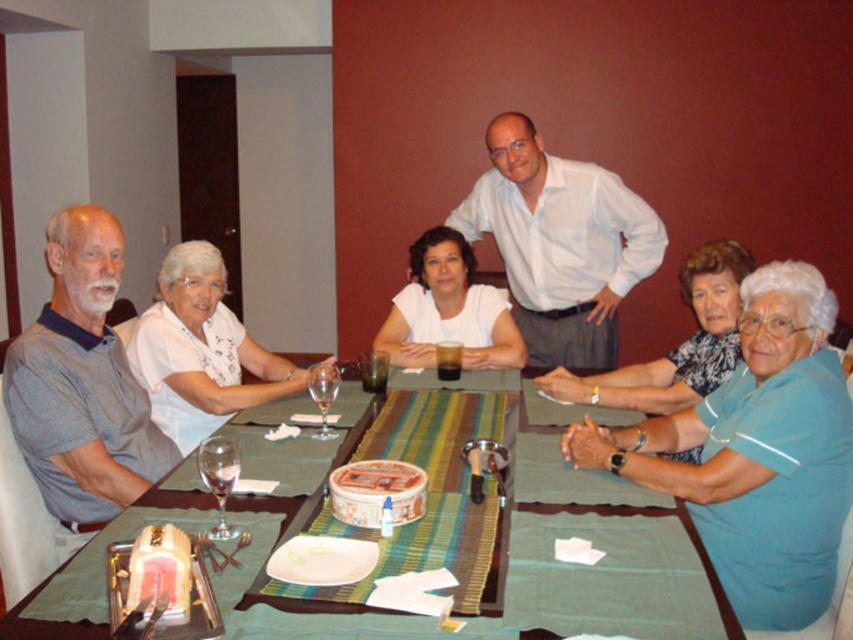
You are a guest at the dinner and want to pass the smooth chocolate cake at center to the person in the white shirt at center. Which direction should you move the cake?

The white shirt at center is to the right of the smooth chocolate cake at center, so you should move the cake to the right to pass it to the person in the white shirt at center.

You are taking a photo of the dining table and want to focus on both the point at position (x=154, y=602) and the point at position (x=397, y=467). Which point should you focus on first to ensure both are in focus?

You should focus on point (x=154, y=602) first because it is closer to the camera than point (x=397, y=467). This way, adjusting the focus from near to far will help both points be in focus.